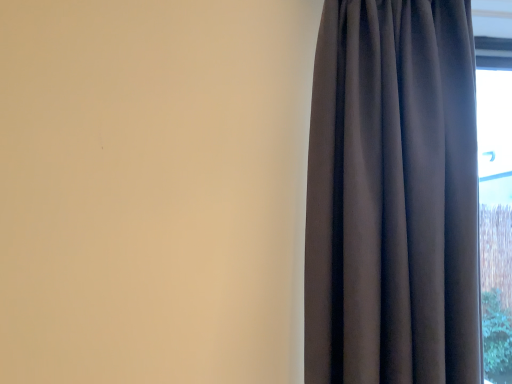
In order to face satin brown curtain at right, should I rotate leftwards or rightwards?

Turn right by 17.280 degrees to look at satin brown curtain at right.

This screenshot has width=512, height=384. I want to click on satin brown curtain at right, so click(x=393, y=196).

What do you see at coordinates (393, 196) in the screenshot? I see `satin brown curtain at right` at bounding box center [393, 196].

The image size is (512, 384). I want to click on satin brown curtain at right, so click(393, 196).